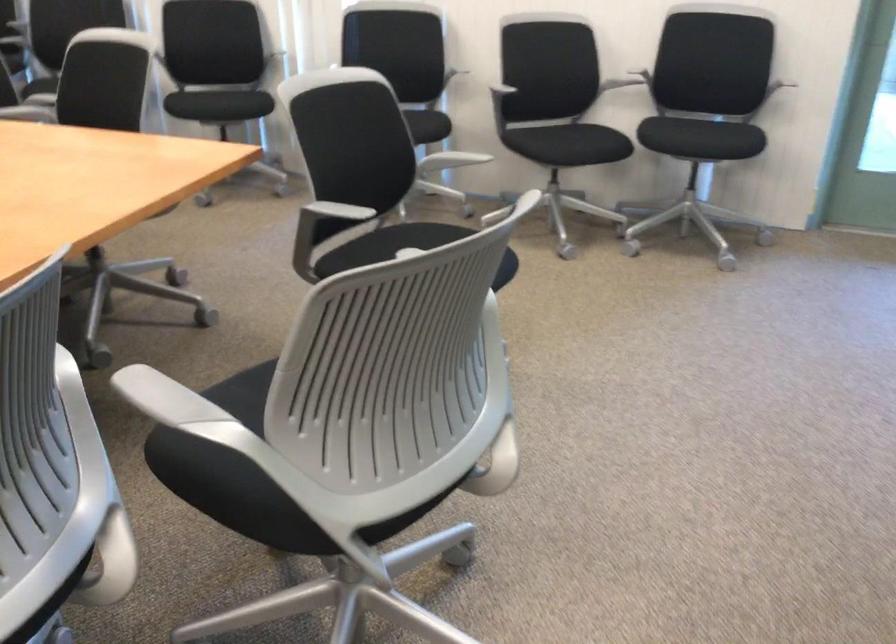
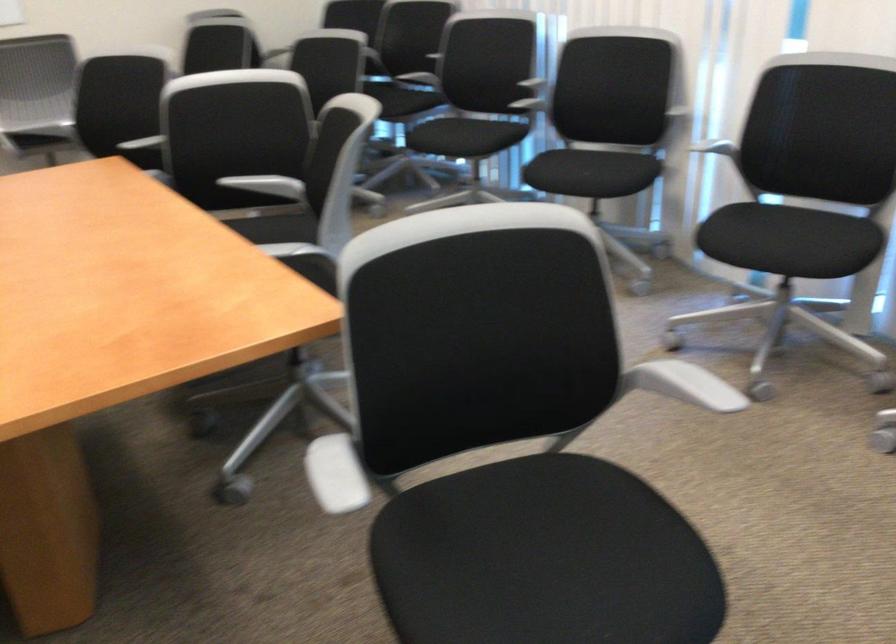
Locate, in the second image, the point that corresponds to the point at 347,214 in the first image.

(334, 474)